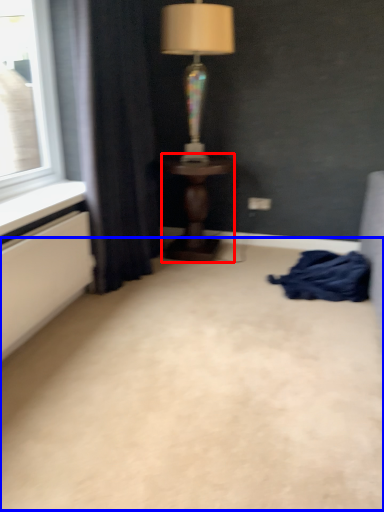
Question: Which object is closer to the camera taking this photo, table (highlighted by a red box) or plain (highlighted by a blue box)?

Choices:
 (A) table
 (B) plain

Answer: (B)